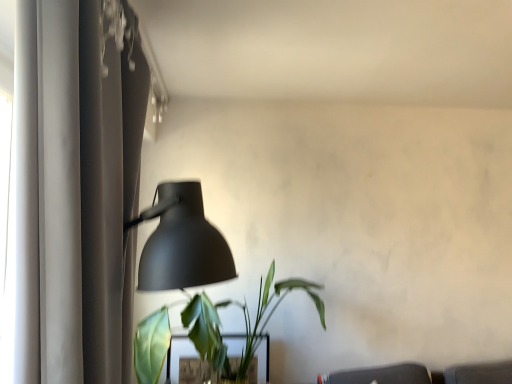
Identify the location of green matte plant at lower center. (178, 356).

Measure the distance between matte black lamp at left and camera.

They are 6.50 feet apart.

Describe the element at coordinates (245, 322) in the screenshot. I see `green matte plant at lower center` at that location.

Locate an element on the screen. green matte plant at lower center is located at coordinates (178, 356).

Who is taller, matte black lamp at left or green matte plant at lower center?

Standing taller between the two is matte black lamp at left.

Identify the location of lamp located above the green matte plant at lower center (from a real-world perspective). (181, 242).

From the picture: Between matte black lamp at left and green matte plant at lower center, which one appears on the right side from the viewer's perspective?

green matte plant at lower center.

Is matte gray curtain at left not near matte black lamp at left?

Yes.

How different are the orientations of matte gray curtain at left and matte black lamp at left in degrees?

The facing directions of matte gray curtain at left and matte black lamp at left are 2.38 degrees apart.

Does matte gray curtain at left turn towards matte black lamp at left?

Yes, matte gray curtain at left is turned towards matte black lamp at left.

Does matte gray curtain at left have a smaller size compared to matte black lamp at left?

Incorrect, matte gray curtain at left is not smaller in size than matte black lamp at left.

Considering the relative sizes of matte gray curtain at left and green matte plant at lower center in the image provided, is matte gray curtain at left taller than green matte plant at lower center?

Yes.

Between point (60, 282) and point (239, 335), which one is positioned in front?

Point (60, 282)

From the picture: Considering the relative positions of matte gray curtain at left and green matte plant at lower center in the image provided, is matte gray curtain at left to the left of green matte plant at lower center from the viewer's perspective?

Correct, you'll find matte gray curtain at left to the left of green matte plant at lower center.

In the image, is matte gray curtain at left positioned in front of or behind green matte plant at lower center?

matte gray curtain at left is positioned closer to the viewer than green matte plant at lower center.

Does green matte plant at lower center appear on the right side of matte black lamp at left?

Yes.

Is green matte plant at lower center far from matte black lamp at left?

No, green matte plant at lower center is in close proximity to matte black lamp at left.

Considering the positions of objects green matte plant at lower center and matte black lamp at left in the image provided, who is behind, green matte plant at lower center or matte black lamp at left?

green matte plant at lower center is more distant.

From a real-world perspective, is green matte plant at lower center positioned under matte black lamp at left based on gravity?

Yes, from a real-world perspective, green matte plant at lower center is under matte black lamp at left.

Are green matte plant at lower center and green matte plant at lower center located far from each other?

No.

Which object is wider, green matte plant at lower center or green matte plant at lower center?

Wider between the two is green matte plant at lower center.

Is green matte plant at lower center smaller than green matte plant at lower center?

Yes.

Identify the location of houseplant in front of the green matte plant at lower center. pos(245,322).

Is green matte plant at lower center to the left or to the right of matte gray curtain at left in the image?

Clearly, green matte plant at lower center is on the right of matte gray curtain at left in the image.

From a real-world perspective, which is physically below, green matte plant at lower center or matte gray curtain at left?

In real-world perspective, green matte plant at lower center is lower.

Does matte black lamp at left have a lesser height compared to green matte plant at lower center?

Indeed, matte black lamp at left has a lesser height compared to green matte plant at lower center.

In the scene shown: Is matte black lamp at left far from green matte plant at lower center?

No, there isn't a large distance between matte black lamp at left and green matte plant at lower center.

Does matte black lamp at left contain green matte plant at lower center?

No.

Considering the relative sizes of matte black lamp at left and green matte plant at lower center in the image provided, is matte black lamp at left thinner than green matte plant at lower center?

Correct, the width of matte black lamp at left is less than that of green matte plant at lower center.

Where is `lamp located on the left of green matte plant at lower center`? This screenshot has height=384, width=512. lamp located on the left of green matte plant at lower center is located at coordinates (181, 242).

Image resolution: width=512 pixels, height=384 pixels. Find the location of `lamp behind the matte gray curtain at left`. lamp behind the matte gray curtain at left is located at coordinates (181, 242).

When comparing their distances from green matte plant at lower center, does matte gray curtain at left or matte black lamp at left seem closer?

The object closer to green matte plant at lower center is matte black lamp at left.

Which object lies further to the anchor point matte gray curtain at left, green matte plant at lower center or green matte plant at lower center?

green matte plant at lower center.

Looking at the image, which one is located further to green matte plant at lower center, matte black lamp at left or matte gray curtain at left?

The object further to green matte plant at lower center is matte gray curtain at left.

In the scene shown: Considering their positions, is matte gray curtain at left positioned closer to green matte plant at lower center than green matte plant at lower center?

green matte plant at lower center is closer to green matte plant at lower center.

Estimate the real-world distances between objects in this image. Which object is further from green matte plant at lower center, matte gray curtain at left or matte black lamp at left?

matte gray curtain at left.

From the image, which object appears to be nearer to matte gray curtain at left, green matte plant at lower center or matte black lamp at left?

matte black lamp at left is closer to matte gray curtain at left.

Considering their positions, is matte gray curtain at left positioned closer to green matte plant at lower center than green matte plant at lower center?

green matte plant at lower center lies closer to green matte plant at lower center than the other object.

Looking at the image, which one is located closer to green matte plant at lower center, green matte plant at lower center or matte gray curtain at left?

Among the two, green matte plant at lower center is located nearer to green matte plant at lower center.

Image resolution: width=512 pixels, height=384 pixels. What are the coordinates of `lamp between matte gray curtain at left and green matte plant at lower center from front to back` in the screenshot? It's located at (181, 242).

Locate an element on the screen. houseplant positioned between matte gray curtain at left and green matte plant at lower center from near to far is located at coordinates (245, 322).

Find the location of a particular element. houseplant positioned between matte black lamp at left and green matte plant at lower center from near to far is located at coordinates (245, 322).

At what (x,y) coordinates should I click in order to perform the action: click on lamp between matte gray curtain at left and green matte plant at lower center along the z-axis. Please return your answer as a coordinate pair (x, y). This screenshot has width=512, height=384. Looking at the image, I should click on (181, 242).